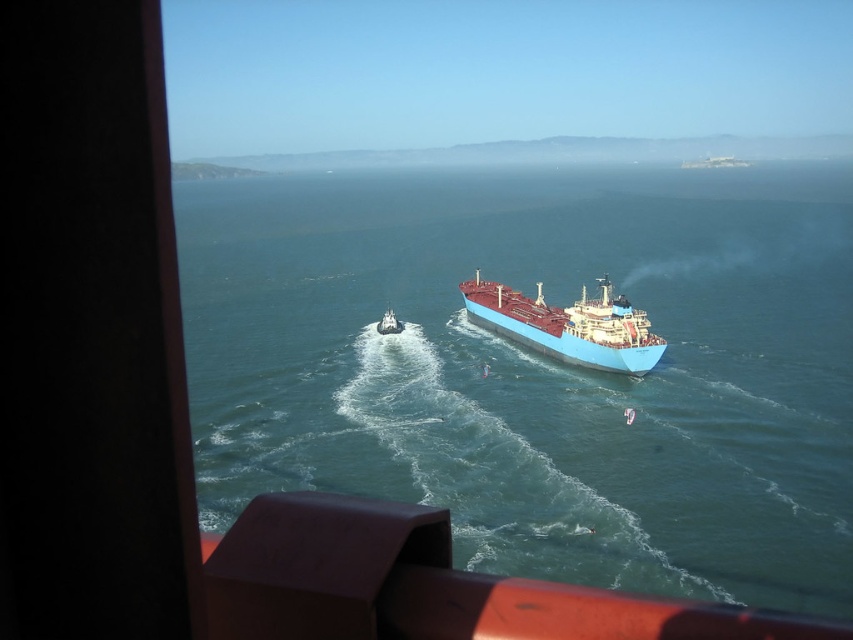
Between blue glossy water at center and blue matte ship at center, which one is positioned higher?

blue glossy water at center is above.

Who is positioned more to the right, blue glossy water at center or blue matte ship at center?

From the viewer's perspective, blue matte ship at center appears more on the right side.

Is point (267, 280) farther from camera compared to point (558, 353)?

Yes, it is behind point (558, 353).

Where is `blue glossy water at center`? The width and height of the screenshot is (853, 640). blue glossy water at center is located at coordinates (540, 368).

In the scene shown: Between blue glossy water at center and metallic gray boat at center, which one is positioned lower?

metallic gray boat at center is lower down.

Which is behind, point (665, 358) or point (398, 326)?

Positioned behind is point (398, 326).

Locate an element on the screen. The width and height of the screenshot is (853, 640). blue glossy water at center is located at coordinates (540, 368).

Who is positioned more to the right, blue matte ship at center or metallic gray boat at center?

Positioned to the right is blue matte ship at center.

Looking at this image, which is below, blue matte ship at center or metallic gray boat at center?

metallic gray boat at center

Locate an element on the screen. blue matte ship at center is located at coordinates (567, 324).

In order to click on blue matte ship at center in this screenshot , I will do [567, 324].